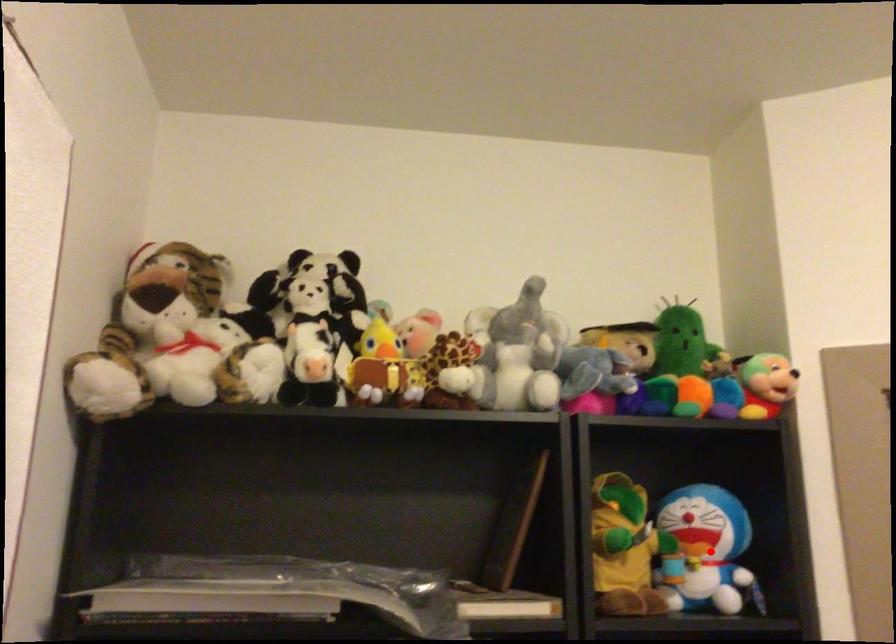
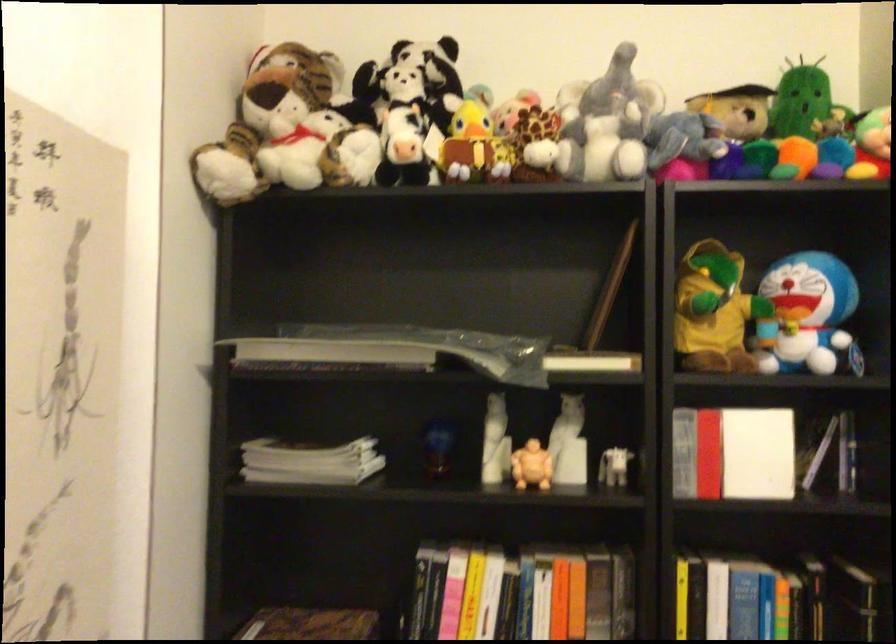
Locate, in the second image, the point that corresponds to the highlighted location in the first image.

(807, 317)